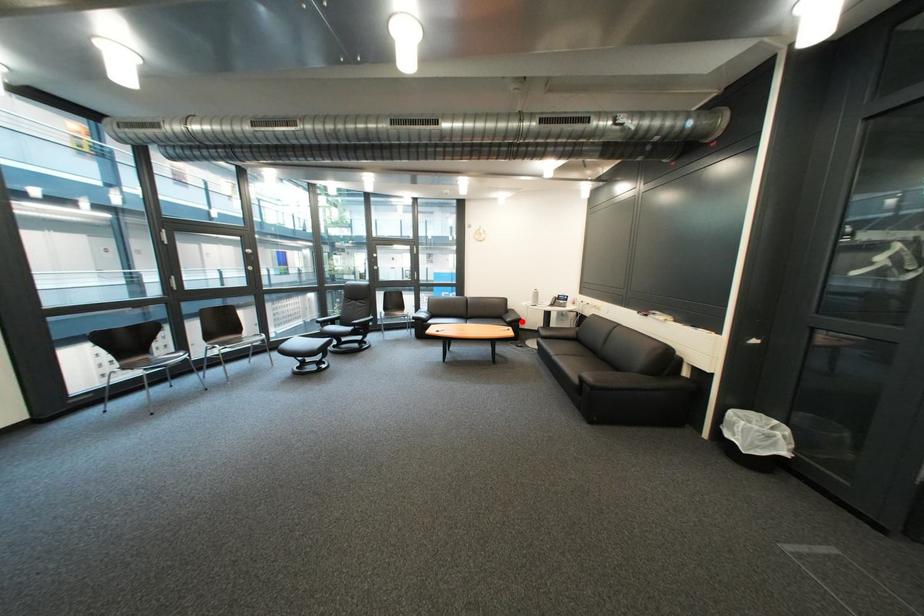
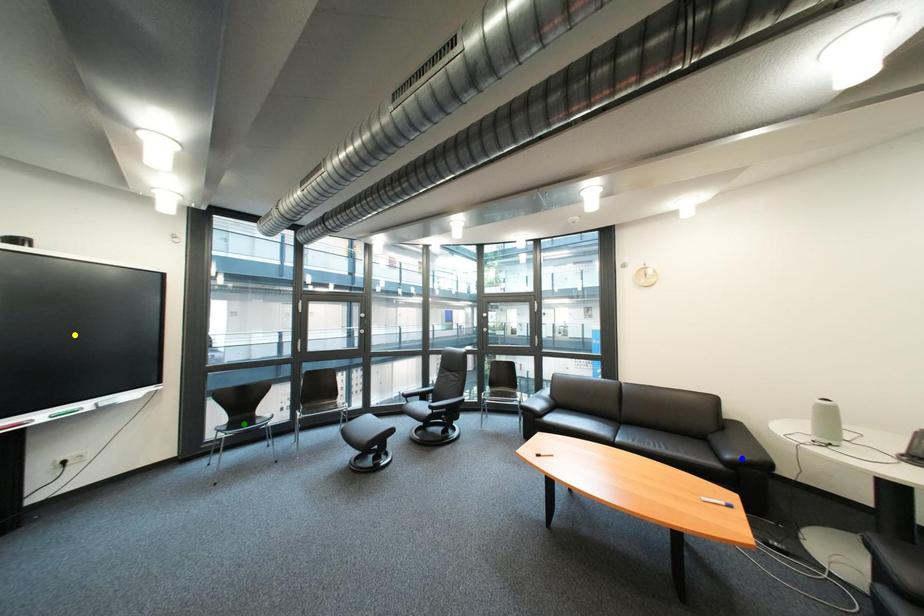
Question: I am providing you with two images of the same scene from different viewpoints. A red point is marked on the first image. You are given multiple points on the second image. Can you choose the point in image 2 that corresponds to the point in image 1?

Choices:
 (A) green point
 (B) blue point
 (C) yellow point

Answer: (B)